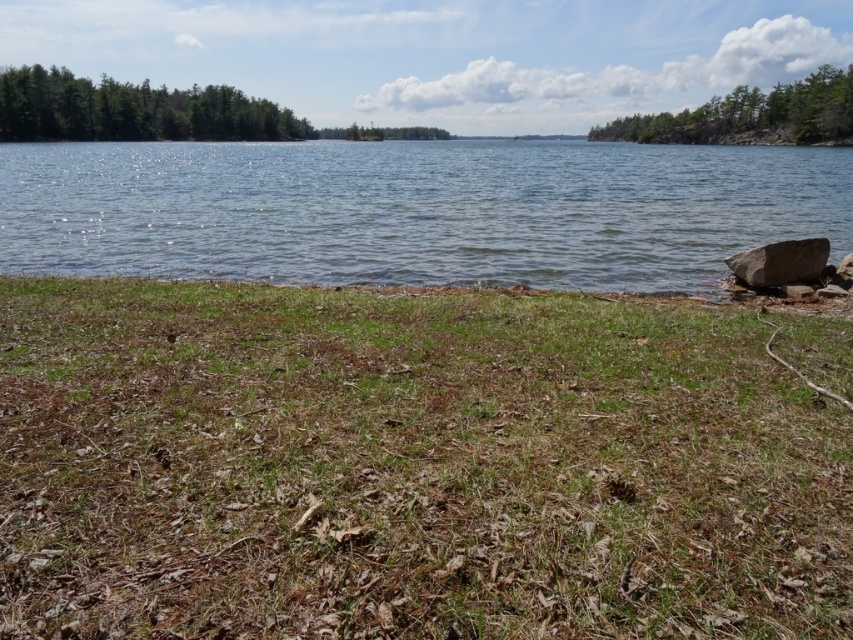
Question: Which of these objects is positioned farthest from the gray smooth rock at right?

Choices:
 (A) green leafy trees at upper right
 (B) clear water at center
 (C) green leafy trees at left
 (D) green dry grass at lower center

Answer: (C)

Question: Which of the following is the farthest from the observer?

Choices:
 (A) (54, 448)
 (B) (67, 132)
 (C) (842, 77)

Answer: (C)

Question: Does clear water at center have a larger size compared to green leafy trees at left?

Choices:
 (A) no
 (B) yes

Answer: (B)

Question: Is green leafy trees at upper right closer to the viewer compared to gray smooth rock at right?

Choices:
 (A) yes
 (B) no

Answer: (B)

Question: Which object is the closest to the green leafy trees at upper right?

Choices:
 (A) clear water at center
 (B) green leafy trees at left
 (C) green dry grass at lower center

Answer: (A)

Question: Does green dry grass at lower center appear on the left side of clear water at center?

Choices:
 (A) yes
 (B) no

Answer: (B)